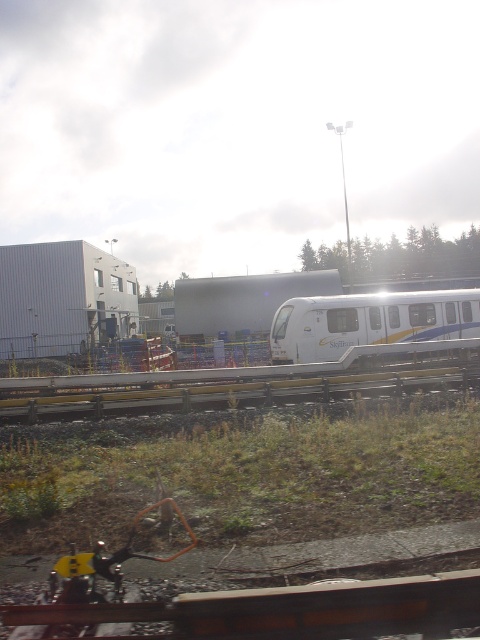
Question: In this image, where is yellow metallic rail at center located relative to white glossy passenger train at center?

Choices:
 (A) above
 (B) below

Answer: (B)

Question: Can you confirm if yellow metallic rail at center is positioned below white glossy passenger train at center?

Choices:
 (A) no
 (B) yes

Answer: (B)

Question: Is yellow metallic rail at center smaller than white glossy passenger train at center?

Choices:
 (A) yes
 (B) no

Answer: (A)

Question: Which point is farther from the camera taking this photo?

Choices:
 (A) (472, 365)
 (B) (285, 314)

Answer: (B)

Question: Which object is farther from the camera taking this photo?

Choices:
 (A) yellow metallic rail at center
 (B) white glossy passenger train at center

Answer: (B)

Question: Which object appears farthest from the camera in this image?

Choices:
 (A) white glossy passenger train at center
 (B) yellow metallic rail at center

Answer: (A)